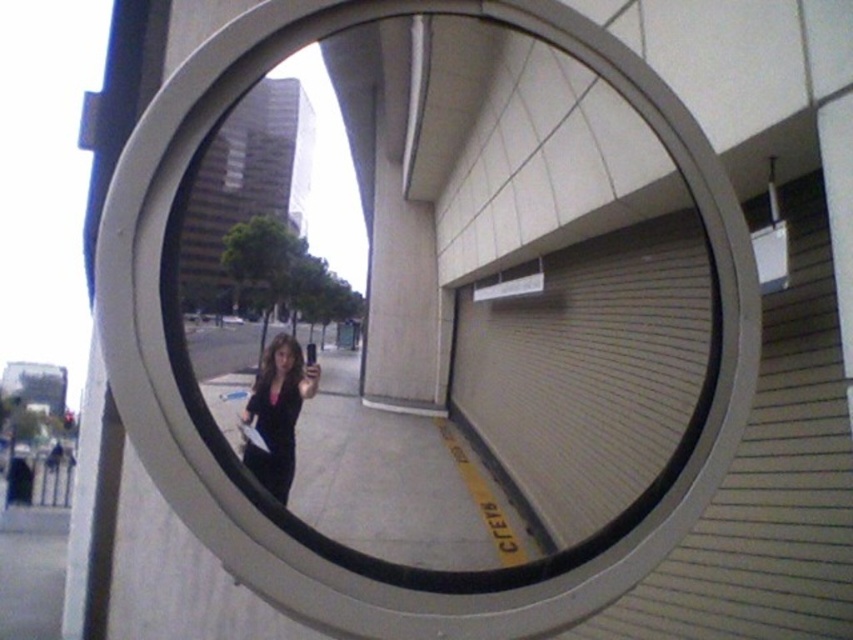
You are a delivery person trying to locate a clear glass mirror in a room. The mirror is placed at a specific coordinate. Can you confirm if the clear glass mirror at center is exactly at point (544, 269)?

Yes, the clear glass mirror at center is exactly located at point (544, 269).

You are navigating through the scene shown in the security camera lens. You need to move from point (495, 93) to point (287, 364). Which direction should you move relative to your current position?

You should move away from the viewer because point (287, 364) is further away from the viewer compared to point (495, 93).